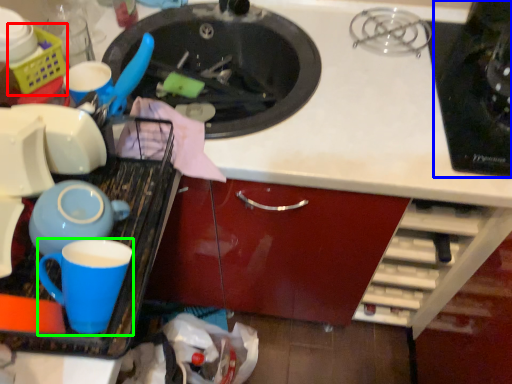
Question: Which object is positioned closest to basket (highlighted by a red box)? Select from appliance (highlighted by a blue box) and coffee cup (highlighted by a green box).

Choices:
 (A) appliance
 (B) coffee cup

Answer: (B)